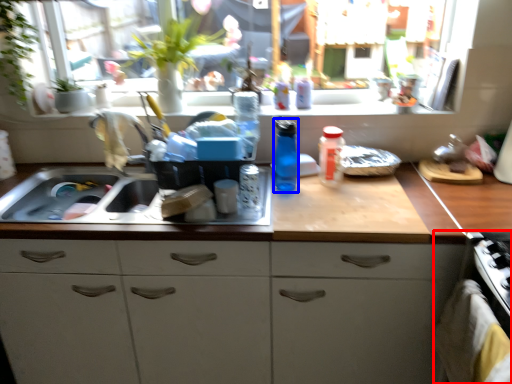
Question: Which point is further to the camera, oven (highlighted by a red box) or bottle (highlighted by a blue box)?

Choices:
 (A) oven
 (B) bottle

Answer: (B)